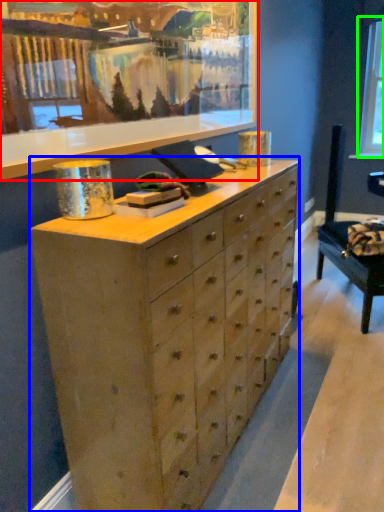
Question: Estimate the real-world distances between objects in this image. Which object is farther from picture frame (highlighted by a red box), chest of drawers (highlighted by a blue box) or window screen (highlighted by a green box)?

Choices:
 (A) chest of drawers
 (B) window screen

Answer: (B)